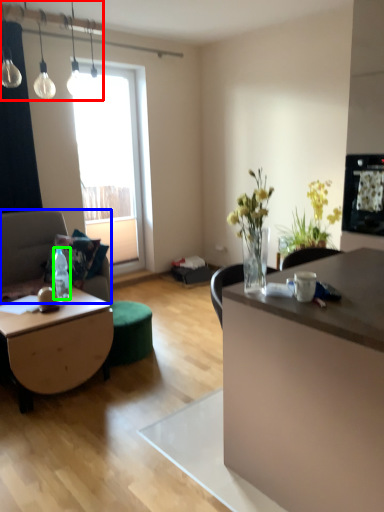
Question: Based on their relative distances, which object is nearer to lamp (highlighted by a red box)? Choose from studio couch (highlighted by a blue box) and bottle (highlighted by a green box).

Choices:
 (A) studio couch
 (B) bottle

Answer: (A)